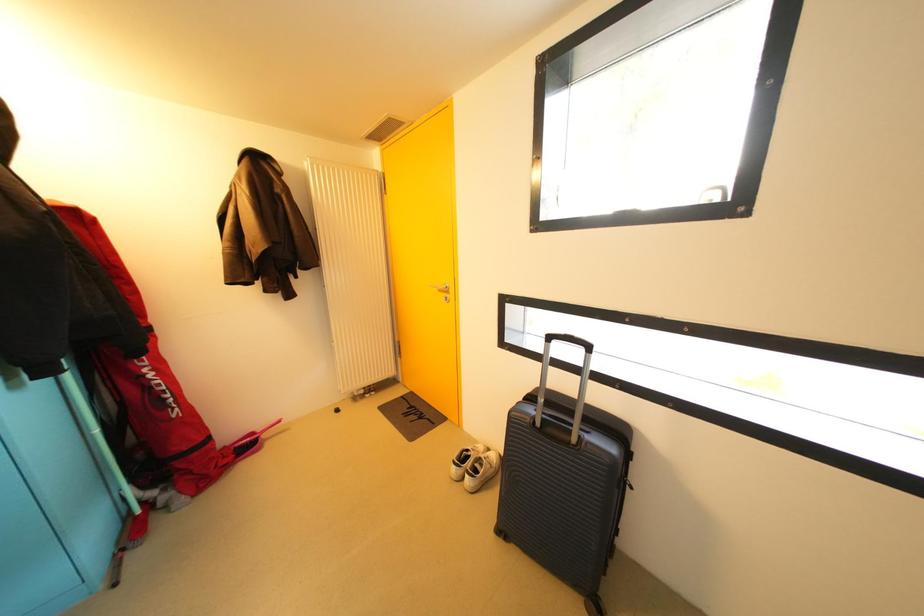
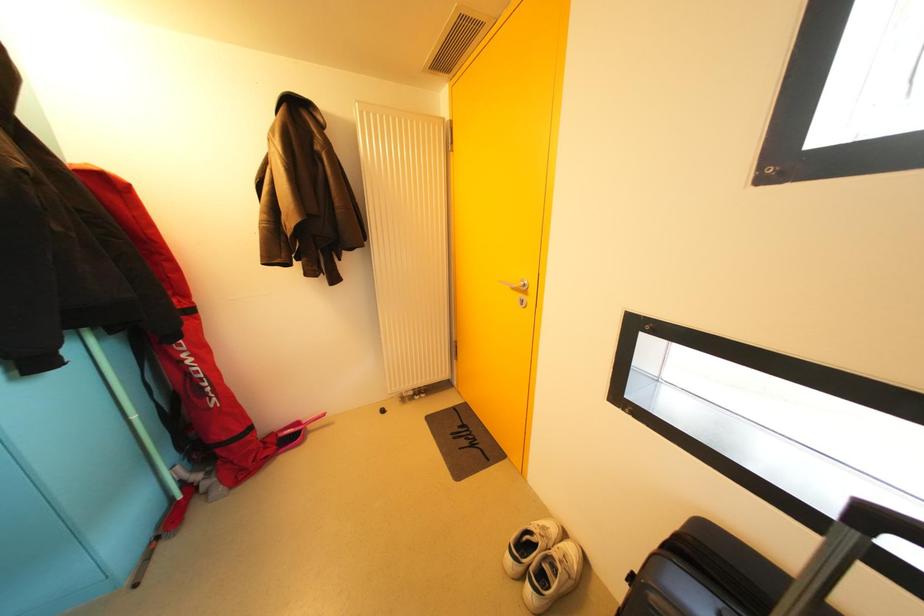
Question: The images are taken continuously from a first-person perspective. In which direction is your viewpoint rotating?

Choices:
 (A) Left
 (B) Right
 (C) Up
 (D) Down

Answer: (A)